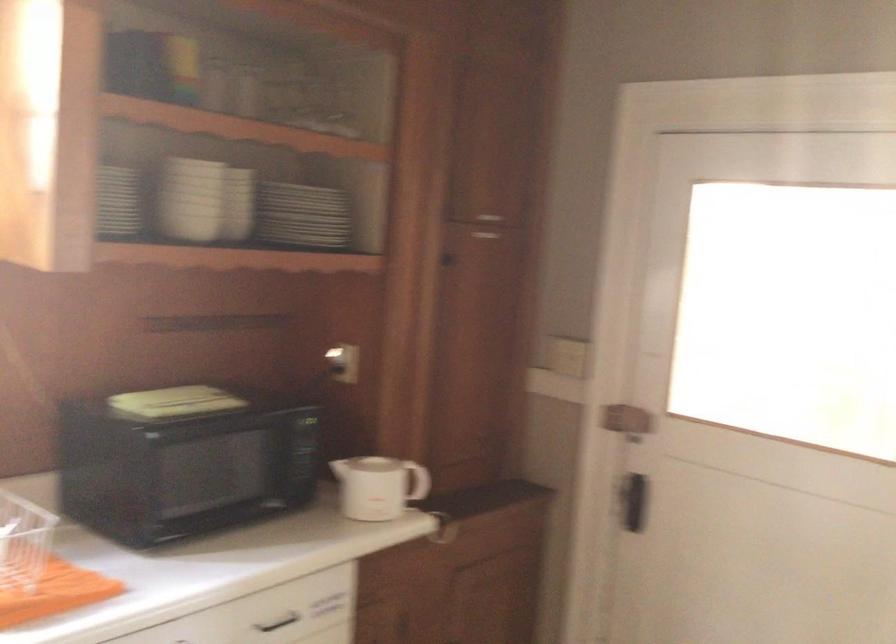
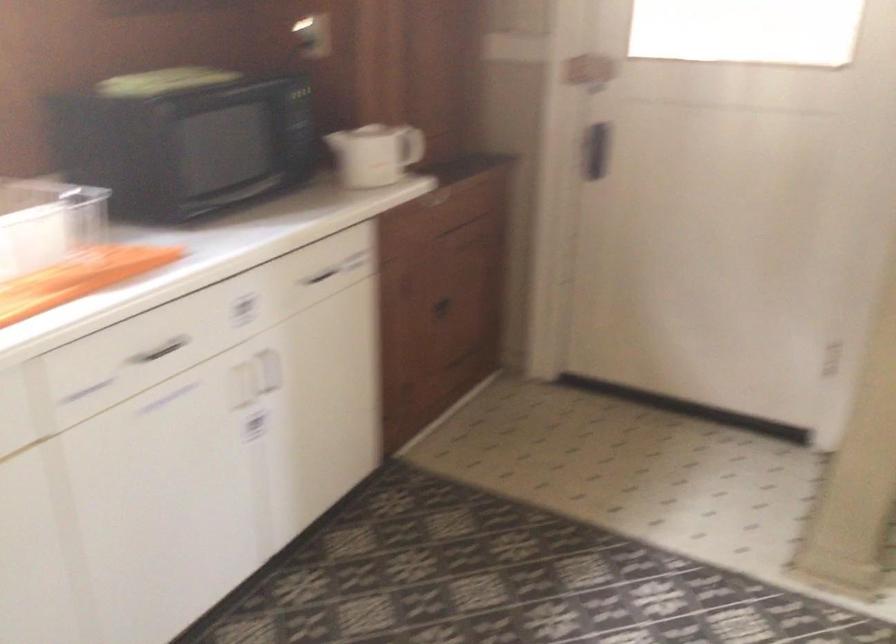
Question: The first image is from the beginning of the video and the second image is from the end. How did the camera likely rotate when shooting the video?

Choices:
 (A) Left
 (B) Right
 (C) Up
 (D) Down

Answer: (D)